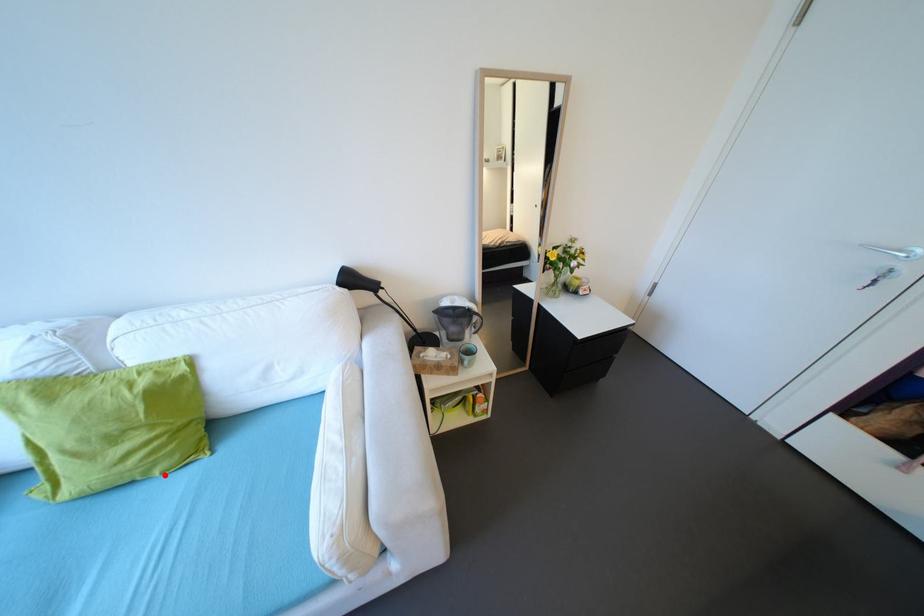
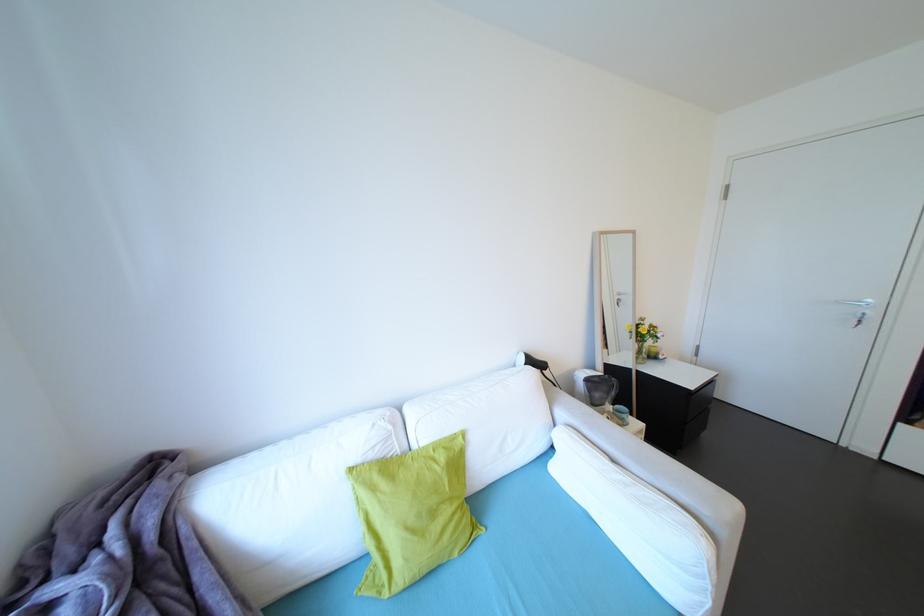
Question: A red point is marked in image1. In image2, is the corresponding 3D point closer to the camera or farther? Reply with the corresponding letter.

Choices:
 (A) The corresponding 3D point is closer.
 (B) The corresponding 3D point is farther.

Answer: (B)